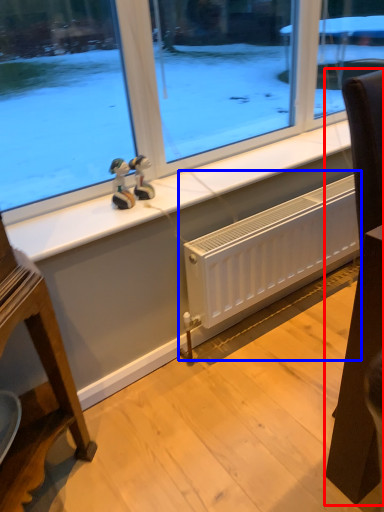
Question: Which object appears farthest to the camera in this image, furniture (highlighted by a red box) or radiator (highlighted by a blue box)?

Choices:
 (A) furniture
 (B) radiator

Answer: (B)